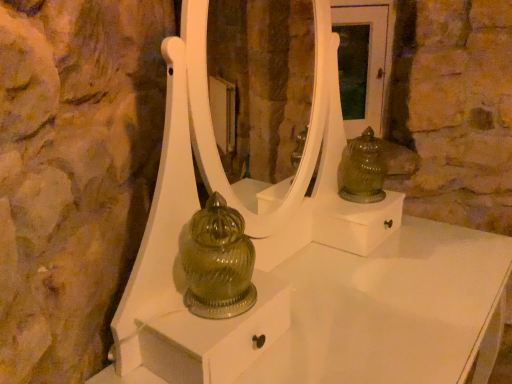
Question: Considering the positions of white glossy mirror at center and green glass figurine at upper right in the image, is white glossy mirror at center bigger or smaller than green glass figurine at upper right?

Choices:
 (A) small
 (B) big

Answer: (B)

Question: From the image's perspective, is white glossy mirror at center positioned above or below green glass figurine at upper right?

Choices:
 (A) below
 (B) above

Answer: (B)

Question: From a real-world perspective, is white glossy mirror at center above or below green glass figurine at upper right?

Choices:
 (A) above
 (B) below

Answer: (A)

Question: From a real-world perspective, is green glass figurine at upper right physically located above or below white glossy mirror at center?

Choices:
 (A) below
 (B) above

Answer: (A)

Question: Considering the positions of green glass figurine at upper right and white glossy mirror at center in the image, is green glass figurine at upper right wider or thinner than white glossy mirror at center?

Choices:
 (A) wide
 (B) thin

Answer: (B)

Question: Visually, is green glass figurine at upper right positioned to the left or to the right of white glossy mirror at center?

Choices:
 (A) left
 (B) right

Answer: (B)

Question: From the image's perspective, relative to white glossy mirror at center, is green glass figurine at upper right above or below?

Choices:
 (A) above
 (B) below

Answer: (B)